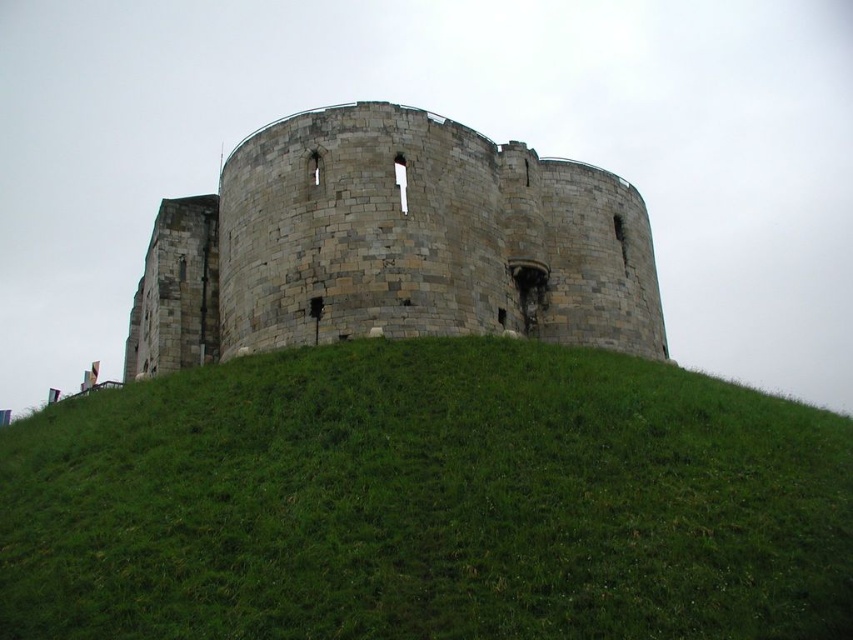
How distant is green grassy hill at center from stone castle at center?

14.54 meters

Does point (294, 433) come farther from viewer compared to point (531, 291)?

No.

Locate an element on the screen. This screenshot has height=640, width=853. green grassy hill at center is located at coordinates (427, 502).